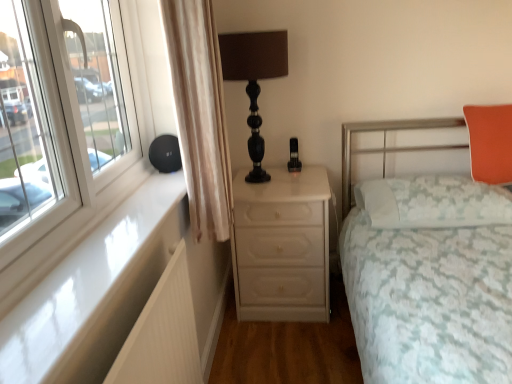
In order to face white glossy chest of drawers at center, should I rotate leftwards or rightwards?

To align with it, rotate right about 3.528°.

What do you see at coordinates (163, 334) in the screenshot? Image resolution: width=512 pixels, height=384 pixels. I see `white ribbed radiator at lower left` at bounding box center [163, 334].

Describe the element at coordinates (490, 143) in the screenshot. I see `orange fabric pillow at upper right, the second pillow from the bottom` at that location.

In order to face white glossy window sill at left, should I rotate leftwards or rightwards?

You should rotate left by 18.142 degrees.

The width and height of the screenshot is (512, 384). What are the coordinates of `white glossy chest of drawers at center` in the screenshot? It's located at (282, 246).

In the scene shown: Is beige fabric curtain at left taller or shorter than orange fabric pillow at upper right, the second pillow from the bottom?

beige fabric curtain at left is taller than orange fabric pillow at upper right, the second pillow from the bottom.

From the image's perspective, is beige fabric curtain at left above orange fabric pillow at upper right, the second pillow from the bottom?

Yes, from the image's perspective, beige fabric curtain at left is above orange fabric pillow at upper right, the second pillow from the bottom.

Is beige fabric curtain at left in front of or behind orange fabric pillow at upper right, acting as the first pillow starting from the top, in the image?

In the image, beige fabric curtain at left appears in front of orange fabric pillow at upper right, acting as the first pillow starting from the top.

Is beige fabric curtain at left positioned with its back to orange fabric pillow at upper right, the second pillow from the bottom?

No, orange fabric pillow at upper right, the second pillow from the bottom, is not at the back of beige fabric curtain at left.

From the image's perspective, is white glossy window sill at left located above or below white lace pillow at right, which is the second pillow in top-to-bottom order?

Clearly, from the image's perspective, white glossy window sill at left is below white lace pillow at right, which is the second pillow in top-to-bottom order.

From the picture: Looking at the image, does white glossy window sill at left seem bigger or smaller compared to white lace pillow at right, which is the second pillow in top-to-bottom order?

white glossy window sill at left is smaller than white lace pillow at right, which is the second pillow in top-to-bottom order.

From the image's perspective, starting from the white glossy window sill at left, which pillow is the 1st one above? Please provide its 2D coordinates.

[(433, 202)]

Is point (2, 359) closer or farther from the camera than point (410, 202)?

Point (2, 359) is closer to the camera than point (410, 202).

From the image's perspective, which one is positioned lower, white glossy window sill at left or white glossy chest of drawers at center?

white glossy chest of drawers at center.

From the picture: Between white glossy window sill at left and white glossy chest of drawers at center, which one is positioned in front?

white glossy window sill at left is in front.

Are white glossy window sill at left and white glossy chest of drawers at center making contact?

No, white glossy window sill at left is not next to white glossy chest of drawers at center.

Is white floral fabric bed at right wider or thinner than orange fabric pillow at upper right, the second pillow from the bottom?

Considering their sizes, white floral fabric bed at right looks broader than orange fabric pillow at upper right, the second pillow from the bottom.

From the picture: Is white floral fabric bed at right turned away from orange fabric pillow at upper right, acting as the first pillow starting from the top?

Yes, orange fabric pillow at upper right, acting as the first pillow starting from the top, is at the back of white floral fabric bed at right.

Is white floral fabric bed at right shorter than orange fabric pillow at upper right, the second pillow from the bottom?

In fact, white floral fabric bed at right may be taller than orange fabric pillow at upper right, the second pillow from the bottom.

Is beige fabric curtain at left situated inside white lace pillow at right, which is counted as the 1th pillow, starting from the bottom, or outside?

beige fabric curtain at left is outside white lace pillow at right, which is counted as the 1th pillow, starting from the bottom.

From the image's perspective, is beige fabric curtain at left located beneath white lace pillow at right, which is the second pillow in top-to-bottom order?

Actually, beige fabric curtain at left appears above white lace pillow at right, which is the second pillow in top-to-bottom order, in the image.

Which is more to the left, beige fabric curtain at left or white lace pillow at right, which is the second pillow in top-to-bottom order?

beige fabric curtain at left.

Which of these two, white floral fabric bed at right or white lace pillow at right, which is counted as the 1th pillow, starting from the bottom, stands taller?

white floral fabric bed at right.

Is white floral fabric bed at right oriented away from white lace pillow at right, which is counted as the 1th pillow, starting from the bottom?

Yes, white floral fabric bed at right's orientation is away from white lace pillow at right, which is counted as the 1th pillow, starting from the bottom.

Looking at this image, can you confirm if white floral fabric bed at right is wider than white lace pillow at right, which is counted as the 1th pillow, starting from the bottom?

Indeed, white floral fabric bed at right has a greater width compared to white lace pillow at right, which is counted as the 1th pillow, starting from the bottom.

The width and height of the screenshot is (512, 384). I want to click on radiator that appears below the white floral fabric bed at right (from the image's perspective), so click(163, 334).

Between white ribbed radiator at lower left and white floral fabric bed at right, which one has more height?

Standing taller between the two is white floral fabric bed at right.

From a real-world perspective, relative to white floral fabric bed at right, is white ribbed radiator at lower left vertically above or below?

white ribbed radiator at lower left is above white floral fabric bed at right.

From the image's perspective, which one is positioned lower, white ribbed radiator at lower left or white floral fabric bed at right?

white ribbed radiator at lower left.

Locate an element on the screen. The height and width of the screenshot is (384, 512). curtain to the left of orange fabric pillow at upper right, acting as the first pillow starting from the top is located at coordinates (200, 114).

Locate an element on the screen. window sill located below the white lace pillow at right, which is counted as the 1th pillow, starting from the bottom (from the image's perspective) is located at coordinates (79, 284).

Looking at this image, considering their positions, is white lace pillow at right, which is the second pillow in top-to-bottom order, positioned further to white ribbed radiator at lower left than black glossy table lamp at upper center?

white lace pillow at right, which is the second pillow in top-to-bottom order, lies further to white ribbed radiator at lower left than the other object.

Based on their spatial positions, is white lace pillow at right, which is the second pillow in top-to-bottom order, or white glossy chest of drawers at center closer to orange fabric pillow at upper right, the second pillow from the bottom?

white lace pillow at right, which is the second pillow in top-to-bottom order, is closer to orange fabric pillow at upper right, the second pillow from the bottom.

Based on their spatial positions, is white glossy window sill at left or beige fabric curtain at left closer to white ribbed radiator at lower left?

Based on the image, white glossy window sill at left appears to be nearer to white ribbed radiator at lower left.

Estimate the real-world distances between objects in this image. Which object is closer to white ribbed radiator at lower left, beige fabric curtain at left or black glossy table lamp at upper center?

Among the two, beige fabric curtain at left is located nearer to white ribbed radiator at lower left.

Consider the image. Based on their spatial positions, is orange fabric pillow at upper right, acting as the first pillow starting from the top, or white floral fabric bed at right further from white lace pillow at right, which is counted as the 1th pillow, starting from the bottom?

orange fabric pillow at upper right, acting as the first pillow starting from the top, is further to white lace pillow at right, which is counted as the 1th pillow, starting from the bottom.

Estimate the real-world distances between objects in this image. Which object is further from white ribbed radiator at lower left, orange fabric pillow at upper right, acting as the first pillow starting from the top, or white lace pillow at right, which is the second pillow in top-to-bottom order?

orange fabric pillow at upper right, acting as the first pillow starting from the top.

Looking at the image, which one is located further to white ribbed radiator at lower left, white lace pillow at right, which is the second pillow in top-to-bottom order, or white glossy chest of drawers at center?

white lace pillow at right, which is the second pillow in top-to-bottom order, lies further to white ribbed radiator at lower left than the other object.

When comparing their distances from white glossy chest of drawers at center, does white glossy window sill at left or white lace pillow at right, which is counted as the 1th pillow, starting from the bottom, seem closer?

white lace pillow at right, which is counted as the 1th pillow, starting from the bottom, is positioned closer to the anchor white glossy chest of drawers at center.

What are the coordinates of `curtain between white glossy window sill at left and white floral fabric bed at right` in the screenshot? It's located at (200, 114).

Where is `bed located between white glossy window sill at left and orange fabric pillow at upper right, acting as the first pillow starting from the top, in the left-right direction`? bed located between white glossy window sill at left and orange fabric pillow at upper right, acting as the first pillow starting from the top, in the left-right direction is located at coordinates (430, 282).

This screenshot has height=384, width=512. Identify the location of pillow situated between beige fabric curtain at left and orange fabric pillow at upper right, acting as the first pillow starting from the top, from left to right. (433, 202).

Image resolution: width=512 pixels, height=384 pixels. I want to click on radiator between white glossy window sill at left and orange fabric pillow at upper right, acting as the first pillow starting from the top, so click(x=163, y=334).